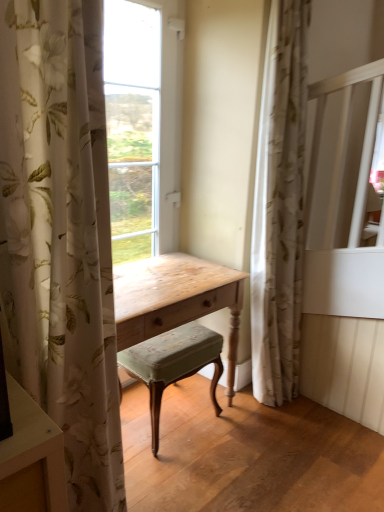
Where is `vacant space in front of floral sheer curtain at right, the second curtain viewed from the front`? vacant space in front of floral sheer curtain at right, the second curtain viewed from the front is located at coordinates (287, 424).